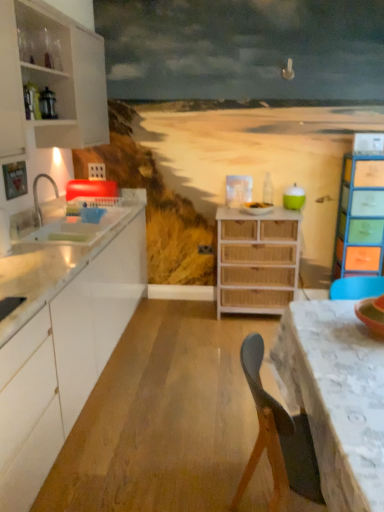
Question: Is woven wood chest of drawers at center, which is the first chest of drawers from left to right, smaller than white lace tablecloth at lower right?

Choices:
 (A) yes
 (B) no

Answer: (A)

Question: Is woven wood chest of drawers at center, which ranks as the 2th chest of drawers in right-to-left order, thinner than white lace tablecloth at lower right?

Choices:
 (A) yes
 (B) no

Answer: (A)

Question: From a real-world perspective, is woven wood chest of drawers at center, which is the first chest of drawers from left to right, beneath white lace tablecloth at lower right?

Choices:
 (A) no
 (B) yes

Answer: (A)

Question: Can you confirm if woven wood chest of drawers at center, which ranks as the 2th chest of drawers in right-to-left order, is positioned to the right of white lace tablecloth at lower right?

Choices:
 (A) no
 (B) yes

Answer: (A)

Question: Can you confirm if woven wood chest of drawers at center, which is the first chest of drawers from left to right, is bigger than white lace tablecloth at lower right?

Choices:
 (A) no
 (B) yes

Answer: (A)

Question: From a real-world perspective, relative to white matte cabinet at left, placed as the second cabinetry when sorted from bottom to top, is white glossy cabinet at left, which appears as the 2th cabinetry when viewed from the top, vertically above or below?

Choices:
 (A) below
 (B) above

Answer: (A)

Question: Is white glossy cabinet at left, positioned as the 1th cabinetry in bottom-to-top order, inside or outside of white matte cabinet at left, placed as the second cabinetry when sorted from bottom to top?

Choices:
 (A) outside
 (B) inside

Answer: (A)

Question: In terms of height, does white glossy cabinet at left, which appears as the 2th cabinetry when viewed from the top, look taller or shorter compared to white matte cabinet at left, placed as the second cabinetry when sorted from bottom to top?

Choices:
 (A) short
 (B) tall

Answer: (B)

Question: From the image's perspective, is white glossy cabinet at left, positioned as the 1th cabinetry in bottom-to-top order, positioned above or below white matte cabinet at left, marked as the first cabinetry in a top-to-bottom arrangement?

Choices:
 (A) above
 (B) below

Answer: (B)

Question: Considering the positions of white lace tablecloth at lower right and white glossy sink at left in the image, is white lace tablecloth at lower right wider or thinner than white glossy sink at left?

Choices:
 (A) wide
 (B) thin

Answer: (A)

Question: Is white lace tablecloth at lower right inside or outside of white glossy sink at left?

Choices:
 (A) outside
 (B) inside

Answer: (A)

Question: In the image, is white lace tablecloth at lower right on the left side or the right side of white glossy sink at left?

Choices:
 (A) left
 (B) right

Answer: (B)

Question: In the image, is white lace tablecloth at lower right positioned in front of or behind white glossy sink at left?

Choices:
 (A) behind
 (B) front

Answer: (B)

Question: Relative to white glossy sink at left, is white glossy cabinet at left, which appears as the 2th cabinetry when viewed from the top, in front or behind?

Choices:
 (A) behind
 (B) front

Answer: (B)

Question: Looking at the image, does white glossy cabinet at left, positioned as the 1th cabinetry in bottom-to-top order, seem bigger or smaller compared to white glossy sink at left?

Choices:
 (A) big
 (B) small

Answer: (A)